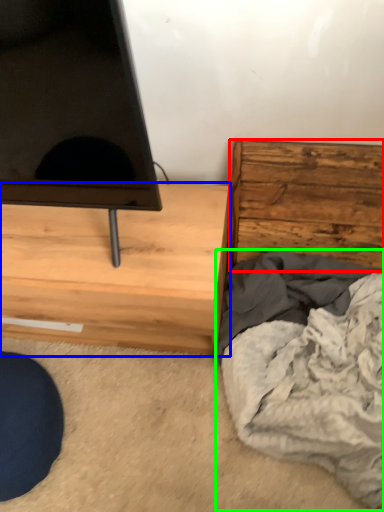
Question: Which object is the closest to the chest of drawers (highlighted by a red box)? Choose among these: chest of drawers (highlighted by a blue box) or blanket (highlighted by a green box).

Choices:
 (A) chest of drawers
 (B) blanket

Answer: (B)